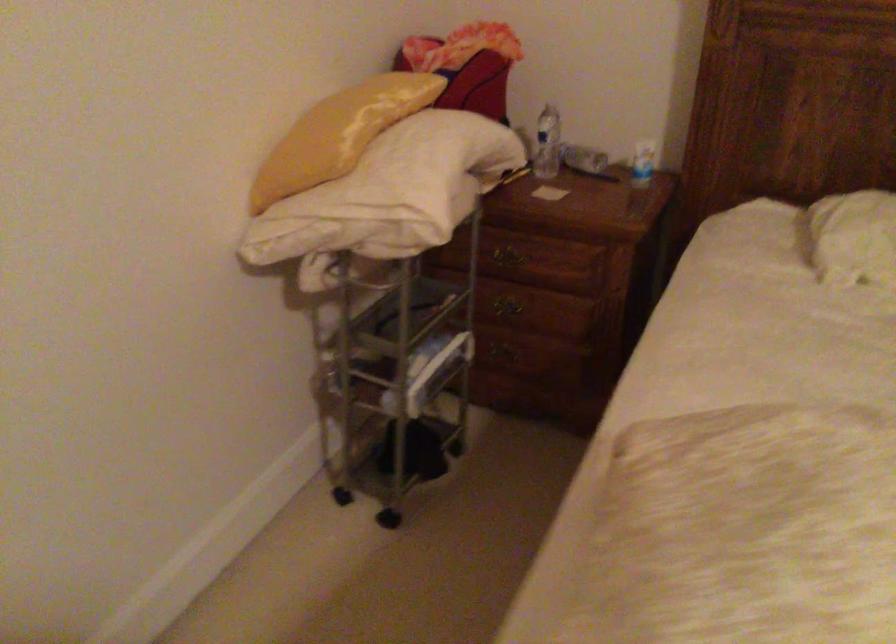
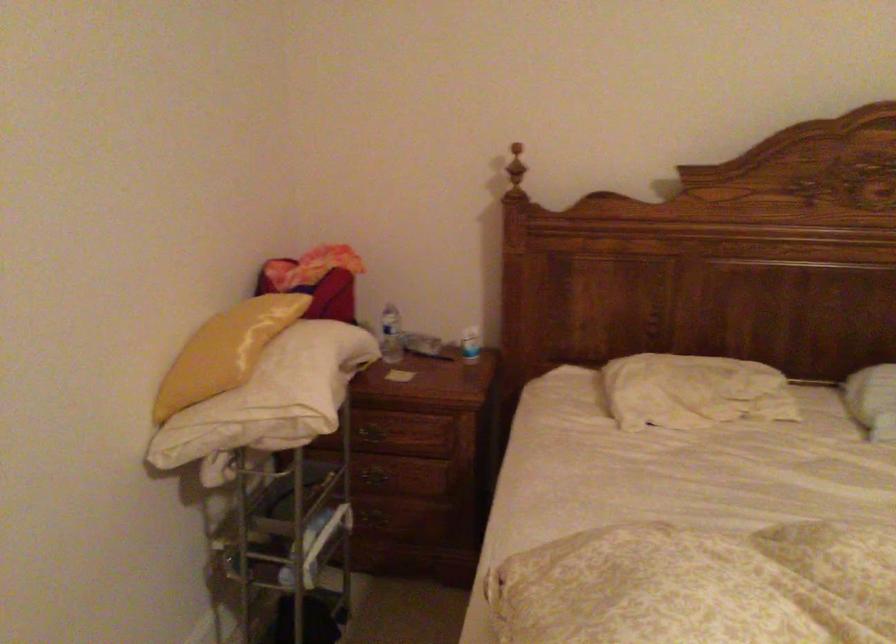
In the second image, find the point that corresponds to point (640, 162) in the first image.

(470, 344)